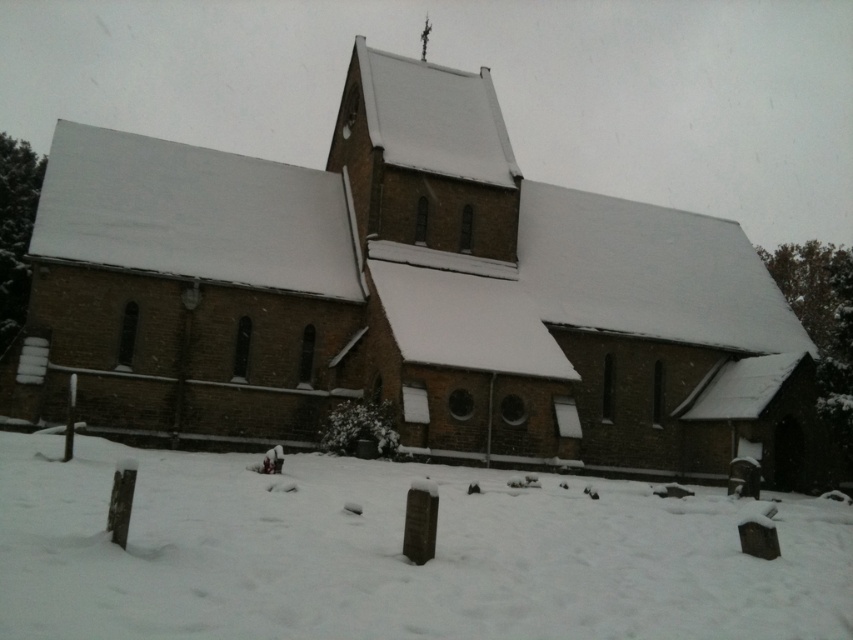
Is brown brick church at center below white powdery snow at lower center?

No.

The height and width of the screenshot is (640, 853). What do you see at coordinates (405, 298) in the screenshot? I see `brown brick church at center` at bounding box center [405, 298].

Locate an element on the screen. This screenshot has height=640, width=853. brown brick church at center is located at coordinates (405, 298).